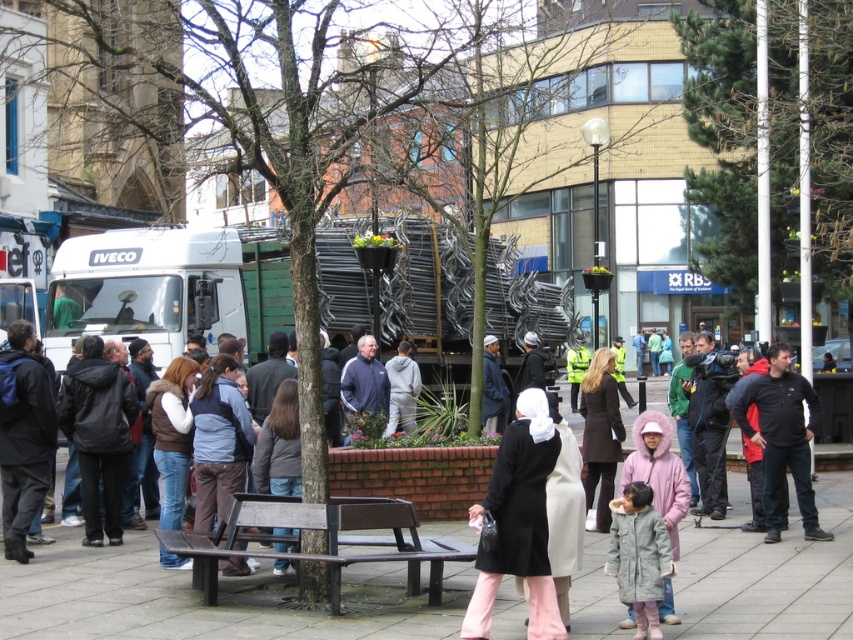
Question: Does wooden bench at center appear over navy blue jacket at center?

Choices:
 (A) no
 (B) yes

Answer: (A)

Question: Which of the following is the farthest from the observer?

Choices:
 (A) (657, 458)
 (B) (361, 401)
 (C) (486, 381)
 (D) (173, 440)

Answer: (C)

Question: In this image, where is smooth concrete pavement at center located relative to navy blue jacket at center?

Choices:
 (A) below
 (B) above

Answer: (A)

Question: Is dark blue jacket at left below black fleece jacket at right?

Choices:
 (A) no
 (B) yes

Answer: (A)

Question: Among these objects, which one is farthest from the camera?

Choices:
 (A) pink fuzzy coat at lower right
 (B) black fleece jacket at right
 (C) light gray fuzzy coat at center
 (D) dark blue jacket at center

Answer: (D)

Question: Which of the following is the closest to the observer?

Choices:
 (A) (351, 416)
 (B) (206, 586)
 (C) (201, 433)
 (D) (13, 531)

Answer: (B)